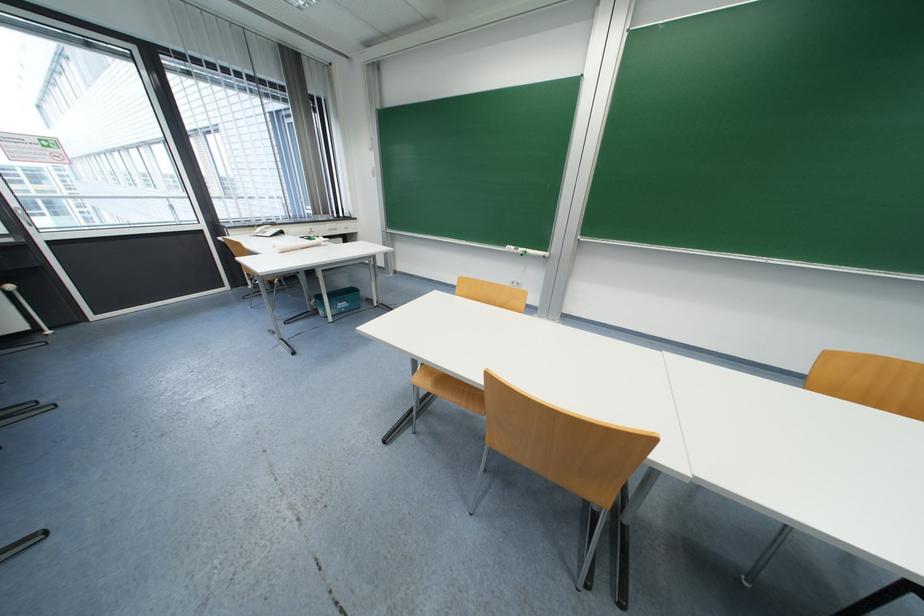
I want to click on green plastic box, so click(x=338, y=301).